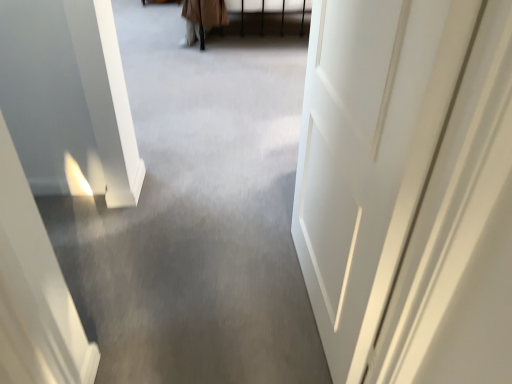
Image resolution: width=512 pixels, height=384 pixels. What do you see at coordinates (202, 18) in the screenshot?
I see `brown leather jacket at upper center` at bounding box center [202, 18].

Image resolution: width=512 pixels, height=384 pixels. Find the location of `brown leather jacket at upper center`. brown leather jacket at upper center is located at coordinates (202, 18).

Measure the distance between brown leather jacket at upper center and camera.

brown leather jacket at upper center and camera are 3.49 meters apart from each other.

The width and height of the screenshot is (512, 384). Find the location of `brown leather jacket at upper center`. brown leather jacket at upper center is located at coordinates (202, 18).